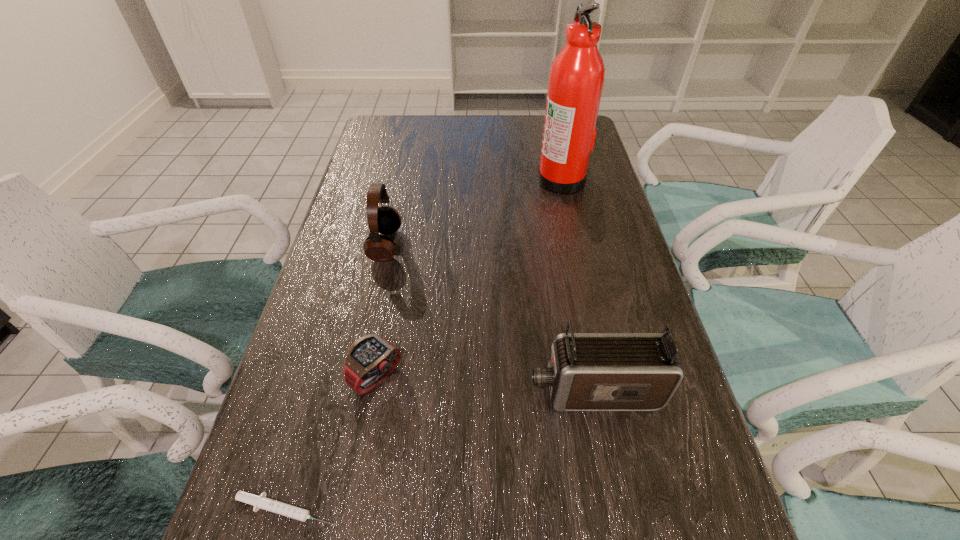
Locate an element on the screen. The image size is (960, 540). vacant space in between the nearest object and the fourth tallest object is located at coordinates (332, 443).

This screenshot has width=960, height=540. In order to click on vacant region between the headset and the nearest object in this screenshot , I will do `click(336, 377)`.

Locate an element on the screen. blank region between the shortest object and the camcorder is located at coordinates (441, 450).

Where is `unoccupied area between the shortest object and the camcorder`? This screenshot has width=960, height=540. unoccupied area between the shortest object and the camcorder is located at coordinates (441, 450).

This screenshot has height=540, width=960. I want to click on empty space between the syringe and the camcorder, so click(441, 450).

Find the location of a particular element. This screenshot has width=960, height=540. object that stands as the fourth closest to the camcorder is located at coordinates (576, 79).

Where is `object that is the second nearest to the second shortest object`? object that is the second nearest to the second shortest object is located at coordinates (586, 371).

The image size is (960, 540). In order to click on vacant area in the image that satisfies the following two spatial constraints: 1. on the label side of the fire extinguisher; 2. on the front side of the shortest object in this screenshot , I will do `click(636, 509)`.

The image size is (960, 540). What are the coordinates of `free region that satisfies the following two spatial constraints: 1. on the ear pads of the fourth nearest object; 2. on the right side of the watch` in the screenshot? It's located at (356, 377).